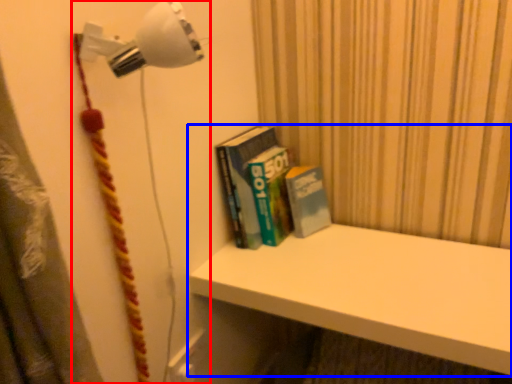
Question: Among these objects, which one is nearest to the camera, lamp (highlighted by a red box) or shelf (highlighted by a blue box)?

Choices:
 (A) lamp
 (B) shelf

Answer: (A)